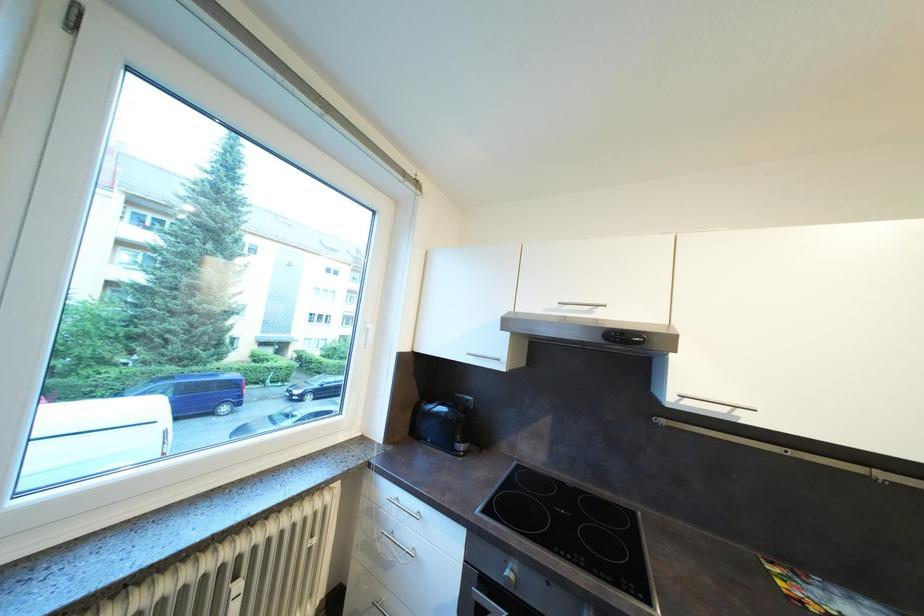
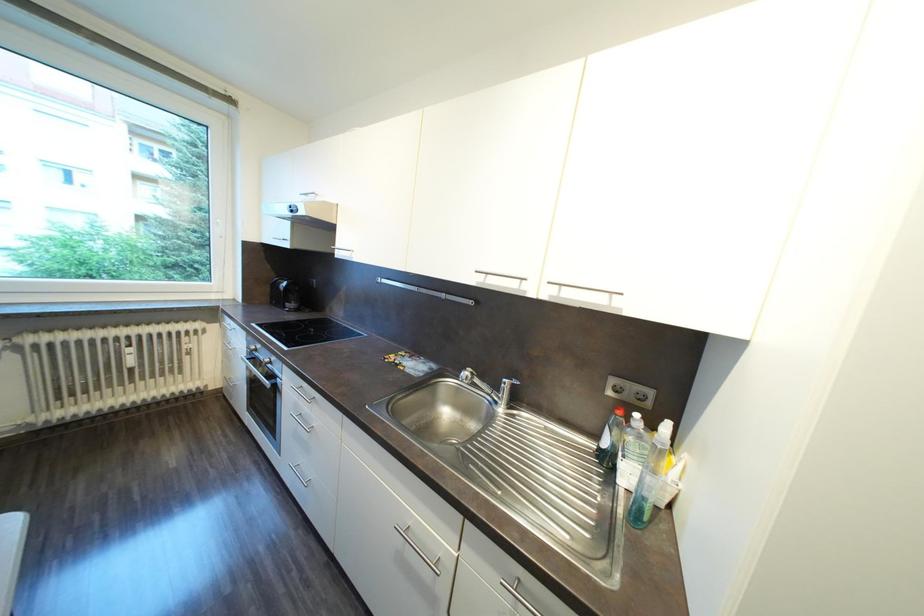
Question: Which direction would the cameraman need to move to produce the second image? Reply with the corresponding letter.

Choices:
 (A) Left
 (B) Right
 (C) Forward
 (D) Backward

Answer: (B)